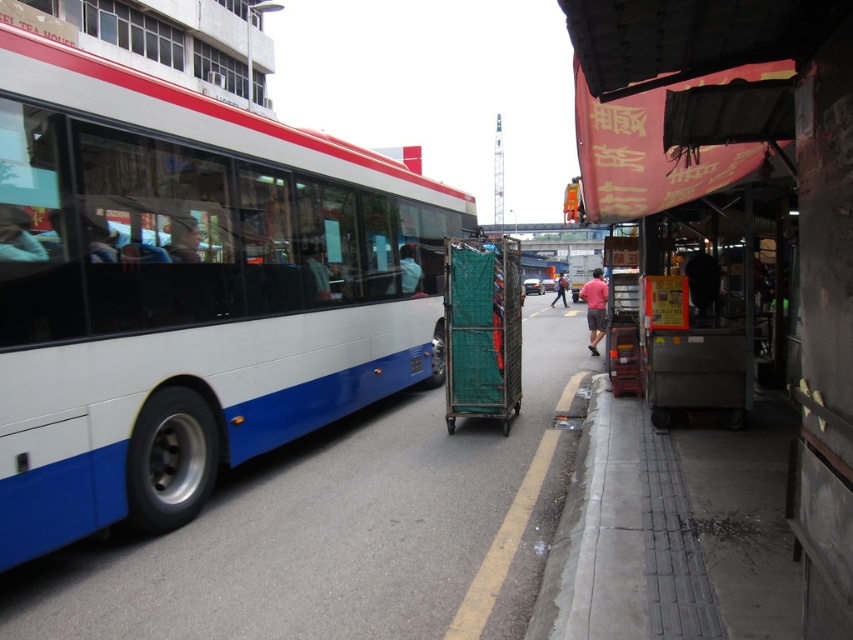
Question: Which is nearer to the metallic cart at right?

Choices:
 (A) matte blue shirt at center
 (B) pink fabric at center
 (C) green mesh cart at center
 (D) pink fabric shorts at center

Answer: (C)

Question: From the image, what is the correct spatial relationship of metallic cart at right in relation to pink fabric at center?

Choices:
 (A) below
 (B) above

Answer: (A)

Question: Does white glossy bus at left lie in front of metallic cart at right?

Choices:
 (A) yes
 (B) no

Answer: (B)

Question: Is matte black shirt at center to the right of pink fabric at center from the viewer's perspective?

Choices:
 (A) yes
 (B) no

Answer: (B)

Question: Which point appears closest to the camera in this image?

Choices:
 (A) (399, 289)
 (B) (833, 83)
 (C) (553, 304)

Answer: (B)

Question: Which point appears farthest from the camera in this image?

Choices:
 (A) (830, 374)
 (B) (196, 234)
 (C) (473, 404)
 (D) (323, 288)

Answer: (C)